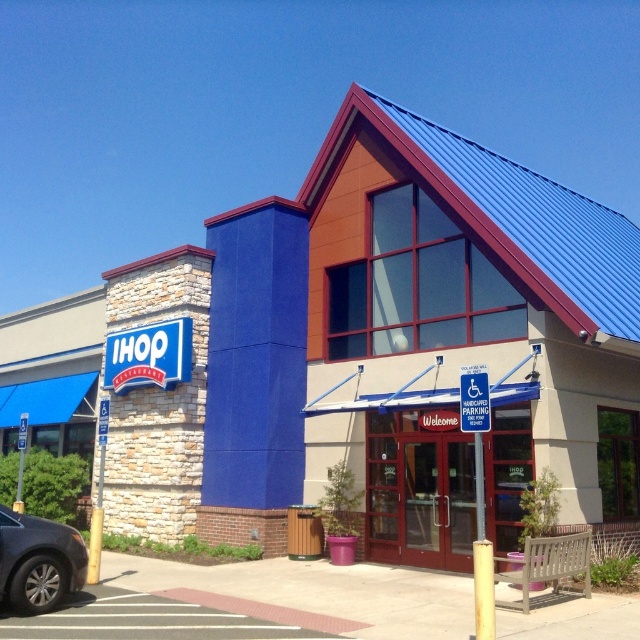
Which is more to the left, matte glass doors at center or shiny black sedan at lower left?

shiny black sedan at lower left is more to the left.

Who is shorter, matte glass doors at center or shiny black sedan at lower left?

shiny black sedan at lower left

This screenshot has height=640, width=640. Describe the element at coordinates (419, 490) in the screenshot. I see `matte glass doors at center` at that location.

Locate an element on the screen. This screenshot has height=640, width=640. matte glass doors at center is located at coordinates (419, 490).